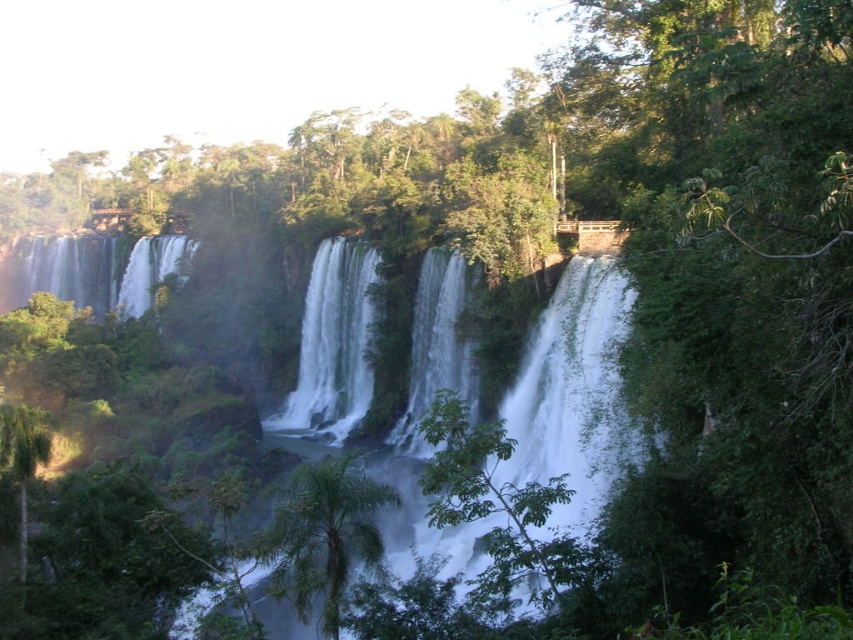
Is point (512, 532) more distant than point (373, 508)?

That is False.

Where is `green leafy tree at center`? The image size is (853, 640). green leafy tree at center is located at coordinates (502, 509).

Is point (532, 497) farther from camera compared to point (343, 563)?

No, it is in front of (343, 563).

The height and width of the screenshot is (640, 853). I want to click on green leafy tree at center, so click(502, 509).

Who is more distant from viewer, (349, 400) or (445, 324)?

The point (349, 400) is more distant.

Is point (350, 401) closer to viewer compared to point (463, 392)?

No, (350, 401) is behind (463, 392).

Identify the location of white frothy water at center. The height and width of the screenshot is (640, 853). (334, 342).

I want to click on green leafy tree at center, so click(502, 509).

In the scene shown: Is green leafy tree at center smaller than white frothy water at center?

Actually, green leafy tree at center might be larger than white frothy water at center.

Which is behind, point (546, 609) or point (291, 400)?

Positioned behind is point (291, 400).

Locate an element on the screen. green leafy tree at center is located at coordinates (502, 509).